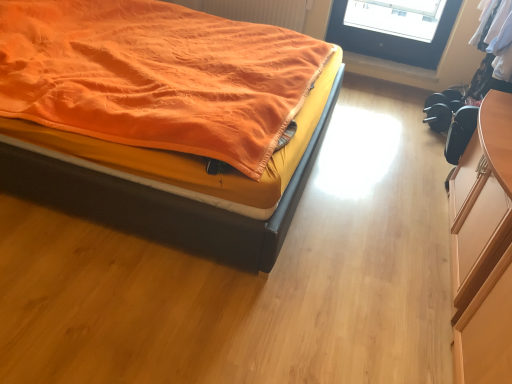
Question: Can you confirm if wooden at lower right is positioned to the right of orange fabric bed at upper left?

Choices:
 (A) no
 (B) yes

Answer: (B)

Question: Is wooden at lower right oriented away from orange fabric bed at upper left?

Choices:
 (A) yes
 (B) no

Answer: (B)

Question: From a real-world perspective, is wooden at lower right beneath orange fabric bed at upper left?

Choices:
 (A) no
 (B) yes

Answer: (B)

Question: Is wooden at lower right further to the viewer compared to orange fabric bed at upper left?

Choices:
 (A) no
 (B) yes

Answer: (B)

Question: Is wooden at lower right wider than orange fabric bed at upper left?

Choices:
 (A) no
 (B) yes

Answer: (A)

Question: Is wooden at lower right taller than orange fabric bed at upper left?

Choices:
 (A) no
 (B) yes

Answer: (A)

Question: From the image's perspective, is orange fabric radiator at upper center beneath wooden at lower right?

Choices:
 (A) no
 (B) yes

Answer: (A)

Question: From the image's perspective, is orange fabric radiator at upper center on top of wooden at lower right?

Choices:
 (A) no
 (B) yes

Answer: (B)

Question: Is orange fabric radiator at upper center taller than wooden at lower right?

Choices:
 (A) no
 (B) yes

Answer: (B)

Question: Considering the relative sizes of orange fabric radiator at upper center and wooden at lower right in the image provided, is orange fabric radiator at upper center wider than wooden at lower right?

Choices:
 (A) yes
 (B) no

Answer: (B)

Question: Is orange fabric radiator at upper center next to wooden at lower right and touching it?

Choices:
 (A) no
 (B) yes

Answer: (A)

Question: Does orange fabric radiator at upper center turn towards wooden at lower right?

Choices:
 (A) no
 (B) yes

Answer: (A)

Question: Is orange fabric radiator at upper center far from orange fabric bed at upper left?

Choices:
 (A) no
 (B) yes

Answer: (B)